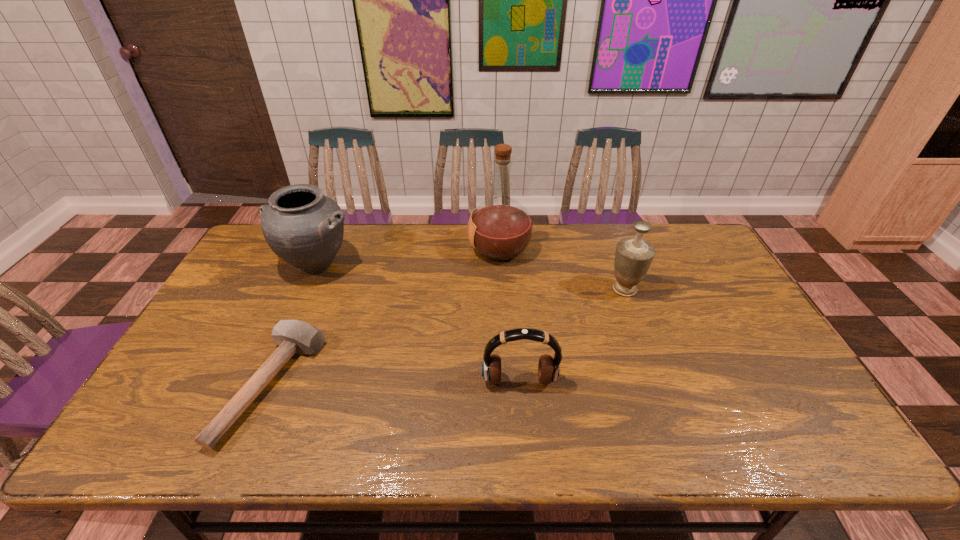
Identify the location of free space located 0.150m on the ear cup of the fourth tallest object. The width and height of the screenshot is (960, 540). (525, 449).

I want to click on free space located 0.160m on the right of the mallet, so click(375, 385).

Identify the location of liquor that is at the far edge. (500, 228).

Locate an element on the screen. urn that is at the far edge is located at coordinates (305, 228).

Locate an element on the screen. object that is at the near edge is located at coordinates (294, 336).

The image size is (960, 540). I want to click on object that is at the left edge, so click(305, 228).

This screenshot has width=960, height=540. In order to click on object that is positioned at the far left corner in this screenshot , I will do `click(305, 228)`.

Image resolution: width=960 pixels, height=540 pixels. In the image, there is a desktop. Identify the location of blank space at the far edge. (619, 236).

Where is `free space at the near edge of the desktop`? The width and height of the screenshot is (960, 540). free space at the near edge of the desktop is located at coordinates (481, 423).

Identify the location of vacant area at the left edge. (210, 369).